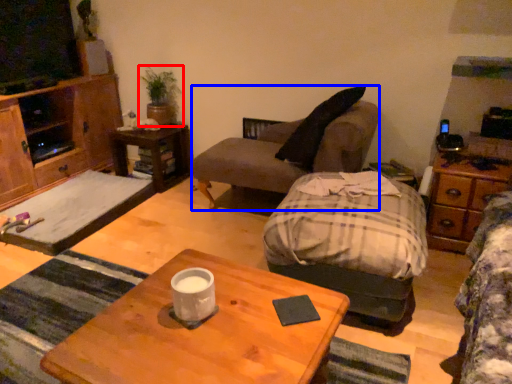
Question: Which object is further to the camera taking this photo, houseplant (highlighted by a red box) or studio couch (highlighted by a blue box)?

Choices:
 (A) houseplant
 (B) studio couch

Answer: (A)